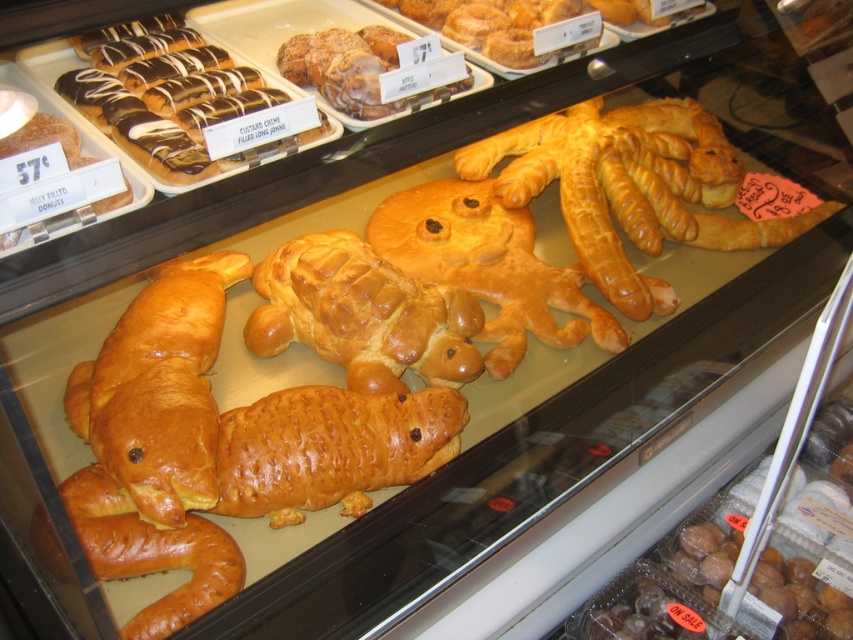
You are a customer at the bakery and want to take a photo of both the golden brown crusty pastry at center and the golden brown croissant at center. Which one should you focus on first to ensure both are in clear view?

You should focus on the golden brown crusty pastry at center first because it is closer to you than the golden brown croissant at center, so by focusing on it, the croissant will also be in focus if they are within the same depth of field.

You are a customer at the bakery and want to choose between the golden brown crusty pastry at center and the golden brown croissant at center. If you prefer a wider pastry, which one should you choose?

The golden brown crusty pastry at center is wider than the golden brown croissant at center, so you should choose the golden brown crusty pastry at center.

You are a customer at the bakery and want to buy both the golden brown braided pastry at center and the golden brown croissant at center. The bakery has a rule that you can only choose items that are positioned above each other. Can you select both items based on their positions?

The golden brown braided pastry at center is above the golden brown croissant at center, so you can select both items since they are positioned above each other according to the bakery rule.